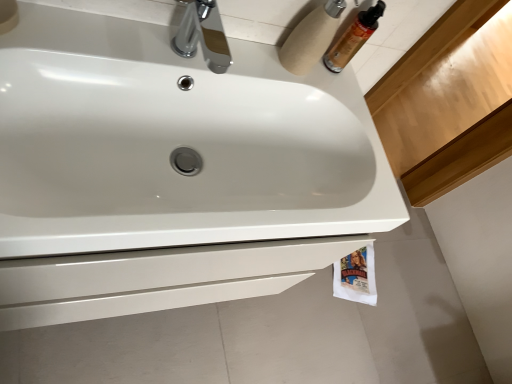
At what (x,y) coordinates should I click in order to perform the action: click on free spot below white paper towel at lower right, the first toilet paper ordered from the bottom (from a real-world perspective). Please return your answer as a coordinate pair (x, y). The image size is (512, 384). Looking at the image, I should click on (355, 273).